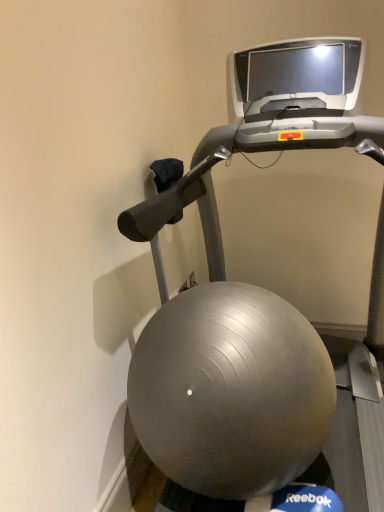
What is the approximate height of silver metallic treadmill at center?

It is 1.60 meters.

What do you see at coordinates (244, 294) in the screenshot?
I see `silver metallic treadmill at center` at bounding box center [244, 294].

Find the location of a particular element. silver metallic treadmill at center is located at coordinates (244, 294).

You are a GUI agent. You are given a task and a screenshot of the screen. Output one action in this format:
    pyautogui.click(x=<x>, y=<y>)
    Task: Click on the silver metallic treadmill at center
    The image size is (384, 512).
    Given the screenshot: What is the action you would take?
    pyautogui.click(x=244, y=294)